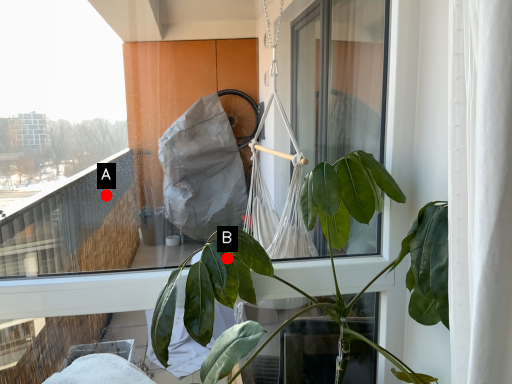
Question: Two points are circled on the image, labeled by A and B beside each circle. Among these points, which one is nearest to the camera?

Choices:
 (A) A is closer
 (B) B is closer

Answer: (B)